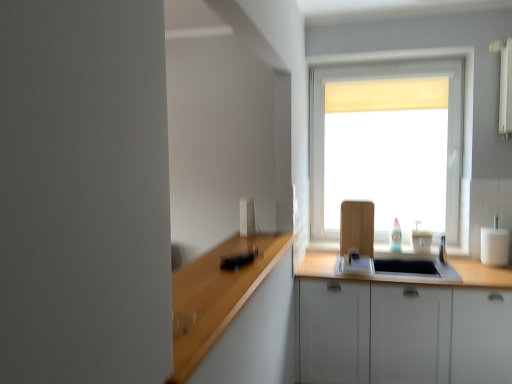
Question: Is white matte cabinet at lower right taller or shorter than white glossy cup at right, the first appliance viewed from the back?

Choices:
 (A) short
 (B) tall

Answer: (B)

Question: Based on their positions, is white matte cabinet at lower right located to the left or right of white glossy cup at right, the first appliance viewed from the back?

Choices:
 (A) right
 (B) left

Answer: (B)

Question: Which object is positioned farthest from the white glossy cup at right, arranged as the first appliance when viewed from the right?

Choices:
 (A) white matte window at center
 (B) white matte cabinet at lower right
 (C) white glossy sink at center
 (D) white glossy toaster at upper center, which is counted as the second appliance, starting from the right

Answer: (D)

Question: Considering the real-world distances, which object is farthest from the white matte window at center?

Choices:
 (A) white glossy toaster at upper center, the first appliance when ordered from front to back
 (B) white glossy sink at center
 (C) white glossy cup at right, which is the second appliance in front-to-back order
 (D) white matte cabinet at lower right

Answer: (A)